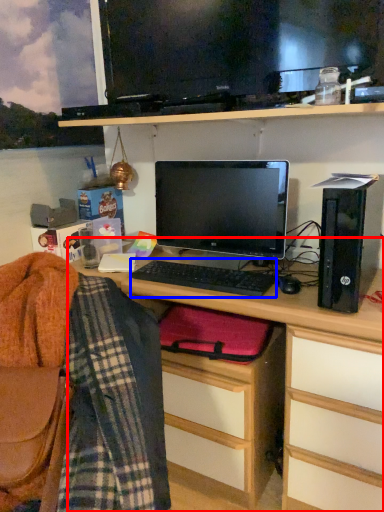
Question: Which object is further to the camera taking this photo, desk (highlighted by a red box) or computer keyboard (highlighted by a blue box)?

Choices:
 (A) desk
 (B) computer keyboard

Answer: (B)